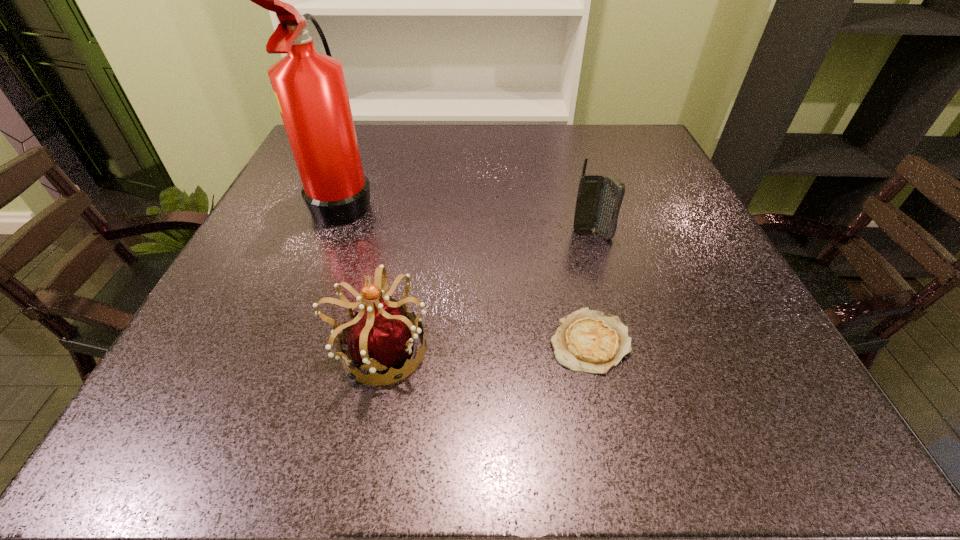
Find the location of a particular element. free spot at the far edge of the desktop is located at coordinates (481, 166).

Identify the location of free region at the near edge. (387, 431).

You are a GUI agent. You are given a task and a screenshot of the screen. Output one action in this format:
    pyautogui.click(x=<x>, y=<y>)
    Task: Click on the vacant space at the left edge of the desktop
    This screenshot has width=960, height=540.
    Given the screenshot: What is the action you would take?
    pyautogui.click(x=301, y=241)

I want to click on free spot at the right edge of the desktop, so (734, 284).

Identify the location of free region at the far right corner of the desktop. The height and width of the screenshot is (540, 960). (647, 137).

Locate an element on the screen. This screenshot has height=540, width=960. free spot between the tiara and the shortest object is located at coordinates (485, 346).

You are a GUI agent. You are given a task and a screenshot of the screen. Output one action in this format:
    pyautogui.click(x=<x>, y=<y>)
    Task: Click on the empty space between the tiara and the cellular telephone
    This screenshot has height=540, width=960.
    Given the screenshot: What is the action you would take?
    pyautogui.click(x=486, y=292)

At what (x,y) coordinates should I click in order to perform the action: click on vacant space that's between the quiche and the tiara. Please return your answer as a coordinate pair (x, y). Looking at the image, I should click on (485, 346).

Identify the location of free area in between the quiche and the tiara. This screenshot has width=960, height=540. (485, 346).

You are a GUI agent. You are given a task and a screenshot of the screen. Output one action in this format:
    pyautogui.click(x=<x>, y=<y>)
    Task: Click on the free point between the tallest object and the tiara
    The image size is (960, 540).
    Given the screenshot: What is the action you would take?
    pyautogui.click(x=362, y=275)